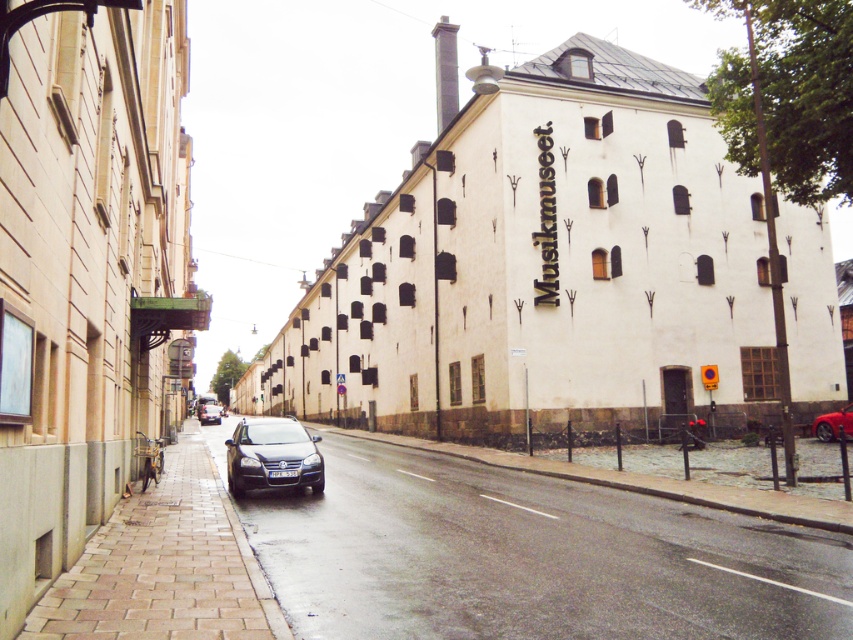
You are a delivery person who needs to park your vehicle on the brown brick pavement at lower left. However, there is a shiny red car at right currently occupying the area. Is there enough space for your vehicle to park there?

The brown brick pavement at lower left is below the shiny red car at right, meaning the car is parked over the pavement. Therefore, there is no space available for your vehicle to park there.

You are standing at the lower left corner of the image. You want to walk to the brown brick pavement at lower left. Which direction should you go?

Since you are already at the lower left corner of the image, you are already at the location of the brown brick pavement at lower left. No need to move.